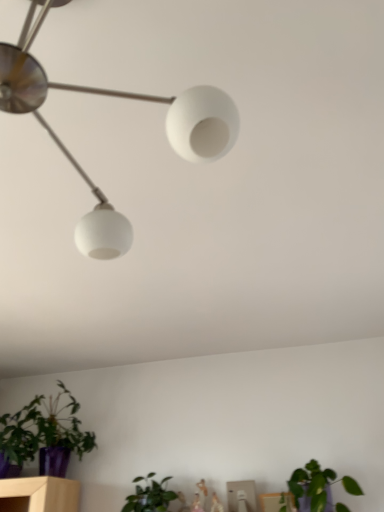
Question: Is matte purple pot at lower left, which is counted as the 2th houseplant, starting from the right, bigger or smaller than green matte plant at lower right, the first houseplant from the right?

Choices:
 (A) small
 (B) big

Answer: (B)

Question: From the image's perspective, is matte purple pot at lower left, which is counted as the 2th houseplant, starting from the right, positioned above or below green matte plant at lower right, the first houseplant from the right?

Choices:
 (A) below
 (B) above

Answer: (B)

Question: Is point click(x=91, y=449) closer or farther from the camera than point click(x=286, y=507)?

Choices:
 (A) farther
 (B) closer

Answer: (A)

Question: Considering the positions of green matte plant at lower right, the first houseplant from the right, and matte purple pot at lower left, positioned as the first houseplant in left-to-right order, in the image, is green matte plant at lower right, the first houseplant from the right, wider or thinner than matte purple pot at lower left, positioned as the first houseplant in left-to-right order,?

Choices:
 (A) thin
 (B) wide

Answer: (A)

Question: From the image's perspective, is green matte plant at lower right, which is counted as the second houseplant, starting from the left, above or below matte purple pot at lower left, positioned as the first houseplant in left-to-right order?

Choices:
 (A) below
 (B) above

Answer: (A)

Question: Considering the relative positions of green matte plant at lower right, which is counted as the second houseplant, starting from the left, and matte purple pot at lower left, positioned as the first houseplant in left-to-right order, in the image provided, is green matte plant at lower right, which is counted as the second houseplant, starting from the left, to the left or to the right of matte purple pot at lower left, positioned as the first houseplant in left-to-right order,?

Choices:
 (A) right
 (B) left

Answer: (A)

Question: Does point (297, 498) appear closer or farther from the camera than point (77, 425)?

Choices:
 (A) farther
 (B) closer

Answer: (B)